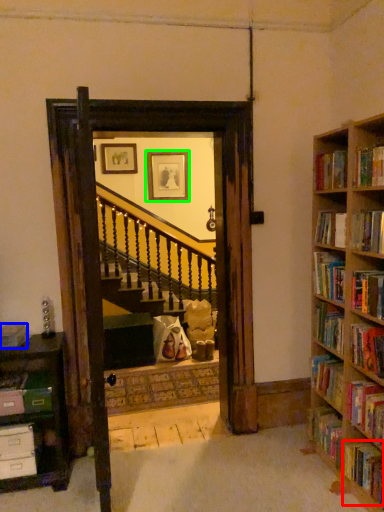
Question: Which object is the farthest from book (highlighted by a red box)? Choose among these: book (highlighted by a blue box) or picture frame (highlighted by a green box).

Choices:
 (A) book
 (B) picture frame

Answer: (B)